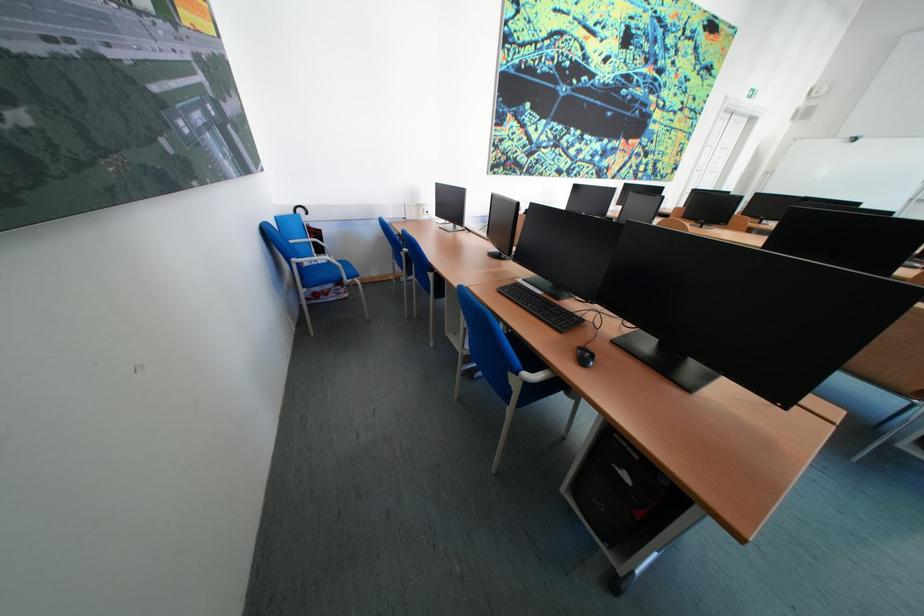
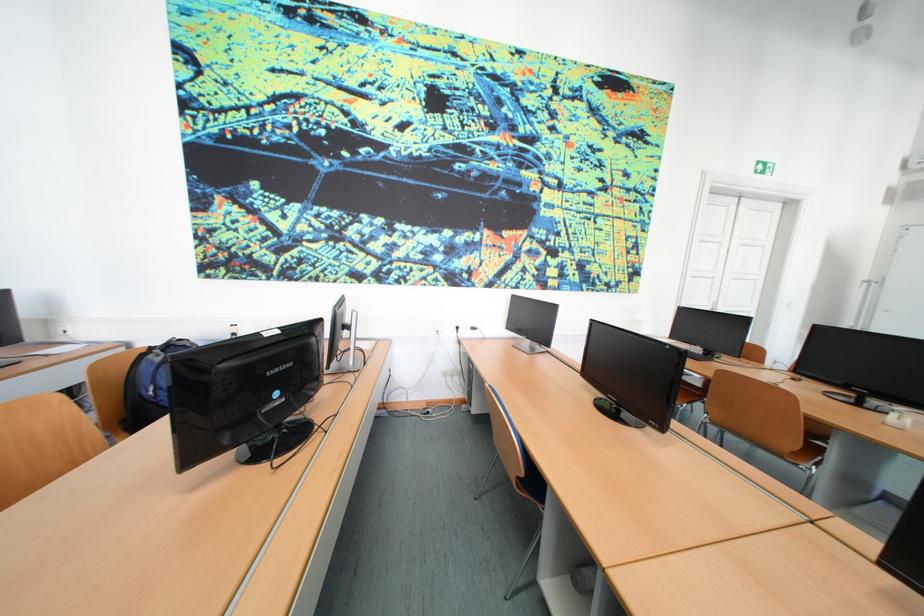
In a continuous first-person perspective shot, in which direction is the camera moving?

The cameraman walked toward right, forward.